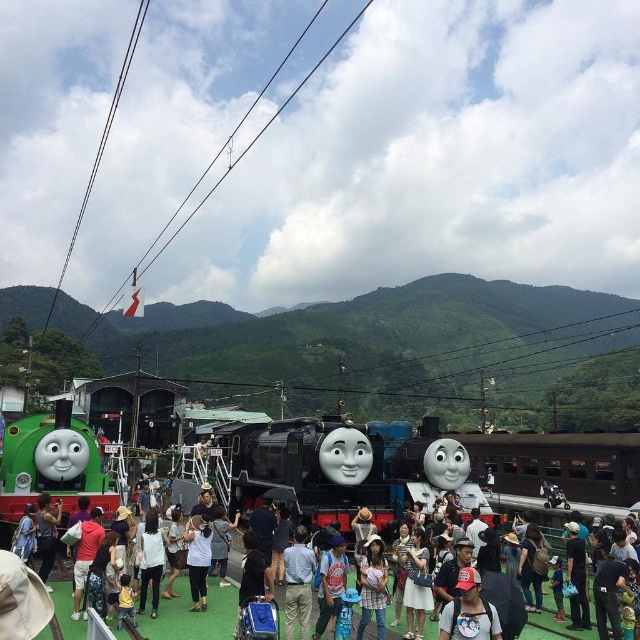
You are a photographer at the train station and want to capture the matte black train at center in your shot. Given that your camera has a limited field of view, can you determine if the point at coordinates (193, 616) is the correct location to focus on to include the matte black train at center in your photo?

Yes, the point at coordinates (193, 616) is where the matte black train at center is located, so focusing there will include it in your photo.

You are standing at the train station and want to take a photo of both the point at position (177, 627) and the point at position (474, 589). Which point should you focus on first to ensure both are in focus?

You should focus on the point at position (177, 627) first because it is closer to the camera than the point at position (474, 589). By focusing on the closer point, the further point will also be in focus due to the depth of field.

You are at the train station and want to take a photo of both the matte black train at center and the white cotton shirt at center. Which object should you focus on first if you want to capture both in the same frame without moving the camera?

The matte black train at center is larger in size than the white cotton shirt at center, so you should focus on the matte black train at center first to ensure it fits properly in the frame before adjusting for the smaller white cotton shirt at center.